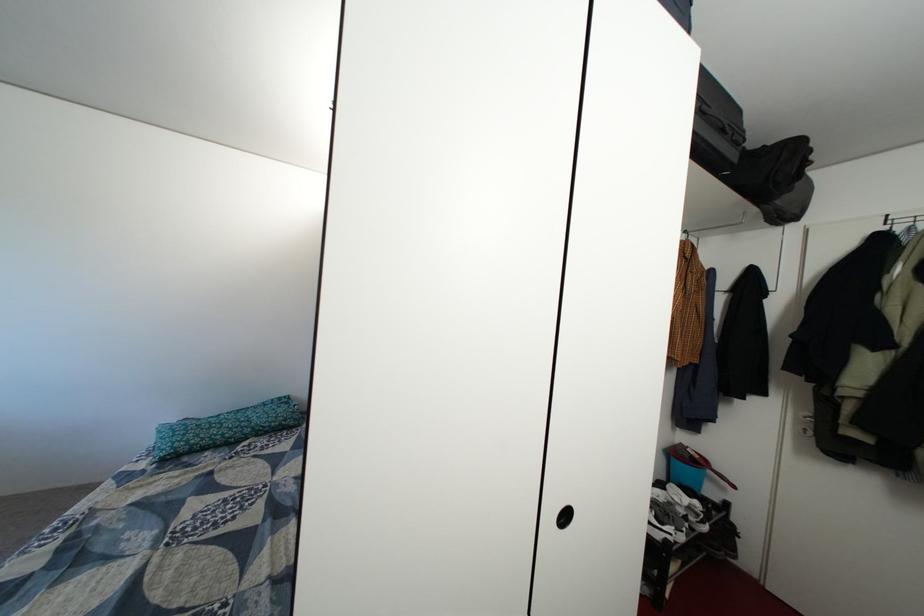
The image size is (924, 616). What do you see at coordinates (715, 127) in the screenshot? I see `the black suitcase` at bounding box center [715, 127].